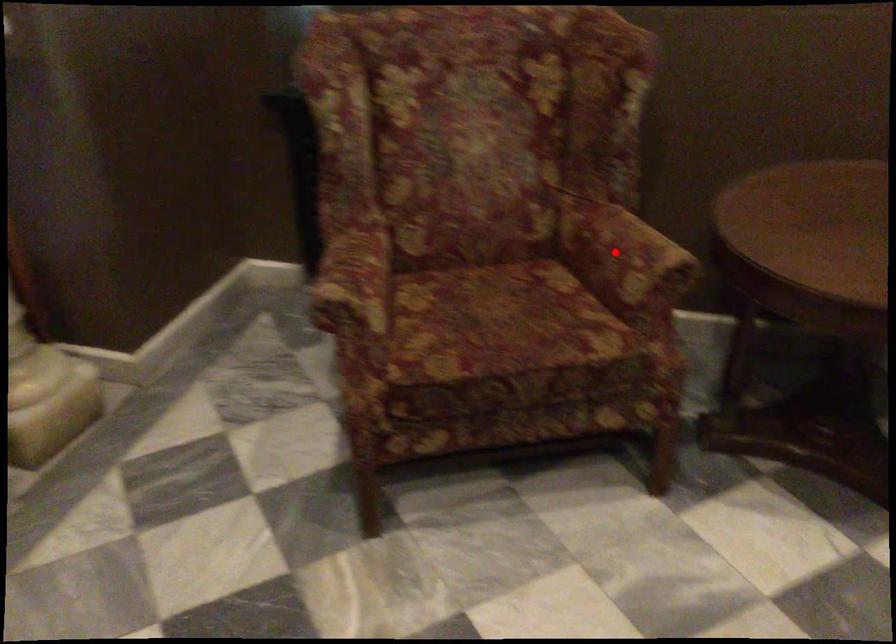
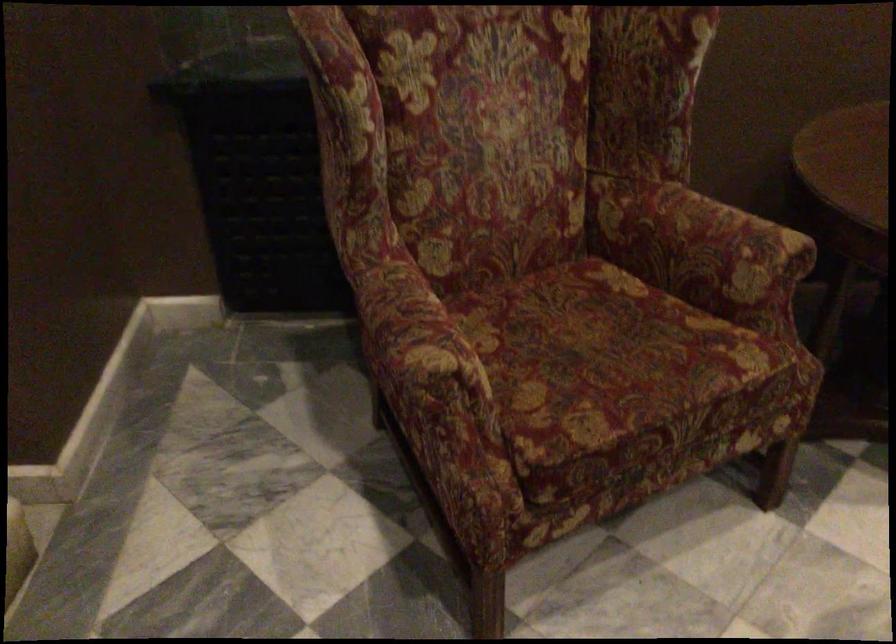
Question: I am providing you with two images of the same scene from different viewpoints. Image1 has a red point marked. In image2, the corresponding 3D location appears at what relative position? Reply with the corresponding letter.

Choices:
 (A) Closer
 (B) Farther

Answer: (A)